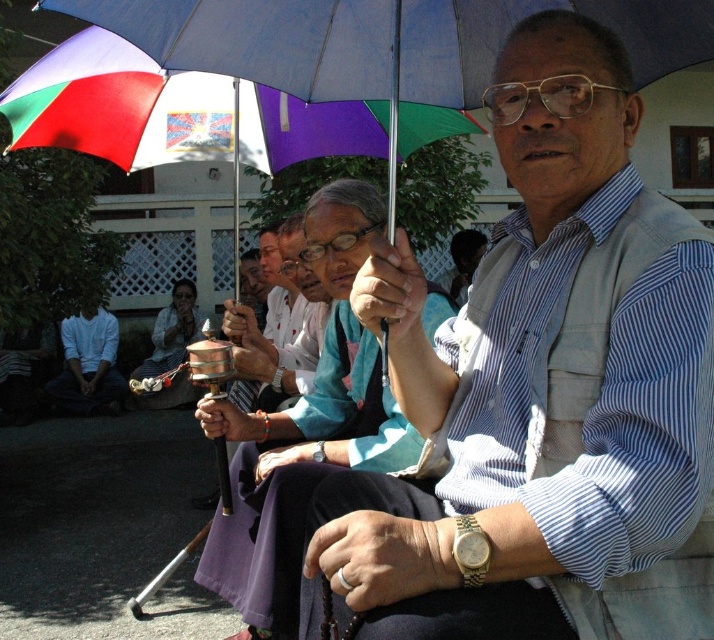
Question: From the image, what is the correct spatial relationship of matte blue shirt at center in relation to multicolored fabric umbrella at upper center?

Choices:
 (A) above
 (B) below

Answer: (B)

Question: Can you confirm if matte black umbrella at center is bigger than multicolored fabric umbrella at upper center?

Choices:
 (A) no
 (B) yes

Answer: (B)

Question: Can you confirm if matte blue shirt at center is smaller than white matte shirt at lower left?

Choices:
 (A) no
 (B) yes

Answer: (A)

Question: Which of these objects is positioned closest to the white matte shirt at lower left?

Choices:
 (A) multicolored fabric umbrella at upper center
 (B) matte blue shirt at center
 (C) matte black umbrella at center

Answer: (A)

Question: Which point appears closest to the camera in this image?

Choices:
 (A) (51, 388)
 (B) (645, 417)

Answer: (B)

Question: Considering the real-world distances, which object is farthest from the matte black umbrella at center?

Choices:
 (A) white matte shirt at lower left
 (B) multicolored fabric umbrella at upper center
 (C) matte blue shirt at center

Answer: (A)